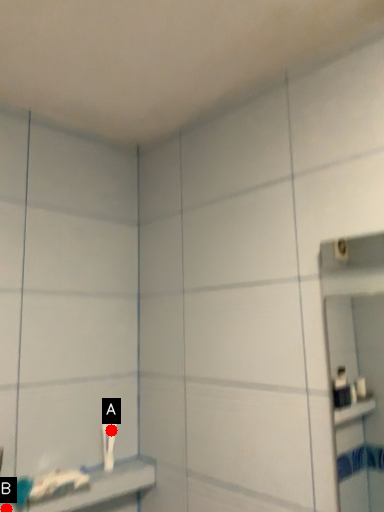
Question: Two points are circled on the image, labeled by A and B beside each circle. Which point is closer to the camera taking this photo?

Choices:
 (A) A is closer
 (B) B is closer

Answer: (B)